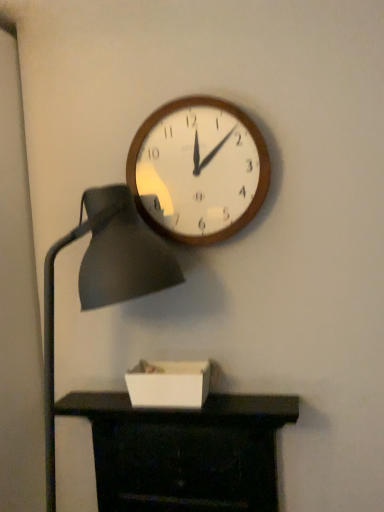
Question: Choose the correct answer: Is matte black fireplace at lower center inside wooden wall clock at upper center or outside it?

Choices:
 (A) inside
 (B) outside

Answer: (B)

Question: From the image's perspective, is matte black fireplace at lower center positioned above or below wooden wall clock at upper center?

Choices:
 (A) below
 (B) above

Answer: (A)

Question: Which object is positioned closest to the wooden wall clock at upper center?

Choices:
 (A) matte black fireplace at lower center
 (B) matte black lampshade at left
 (C) white matte box at lower center

Answer: (B)

Question: Estimate the real-world distances between objects in this image. Which object is closer to the white matte box at lower center?

Choices:
 (A) matte black lampshade at left
 (B) matte black fireplace at lower center
 (C) wooden wall clock at upper center

Answer: (B)